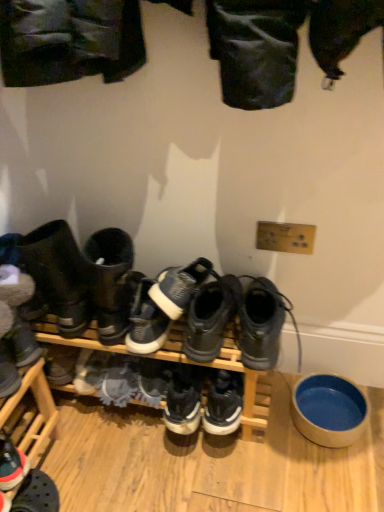
Question: Is blue ceramic bowl at lower right wider or thinner than white suede sneaker at center, placed as the 4th footwear when sorted from left to right?

Choices:
 (A) thin
 (B) wide

Answer: (B)

Question: From a real-world perspective, is blue ceramic bowl at lower right positioned above or below white suede sneaker at center, placed as the 4th footwear when sorted from left to right?

Choices:
 (A) below
 (B) above

Answer: (A)

Question: Estimate the real-world distances between objects in this image. Which object is closer to the white suede sneaker at lower left, which appears as the third footwear when viewed from the left?

Choices:
 (A) white suede sneaker at center, placed as the 4th footwear when sorted from left to right
 (B) suede gray shoe at center, positioned as the 2th shoe in right-to-left order
 (C) gray suede boot at center, arranged as the first footwear when viewed from the right
 (D) blue ceramic bowl at lower right
 (E) leather boots at left, which appears as the fifth footwear when viewed from the right

Answer: (B)

Question: Based on their relative distances, which object is nearer to the suede gray shoe at center, positioned as the 2th shoe in right-to-left order?

Choices:
 (A) blue ceramic bowl at lower right
 (B) white suede shoe at center, the first shoe viewed from the right
 (C) white suede sneaker at center, the 3th footwear in the right-to-left sequence
 (D) reddish-brown leather sneaker at lower left, which is the 1th footwear in left-to-right order
 (E) white suede sneaker at lower left, which appears as the third footwear when viewed from the left

Answer: (B)